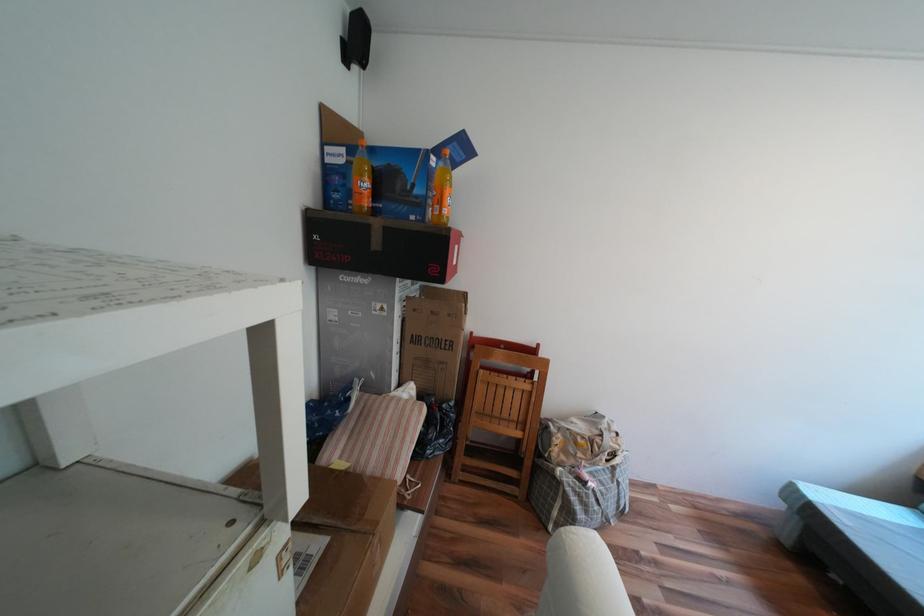
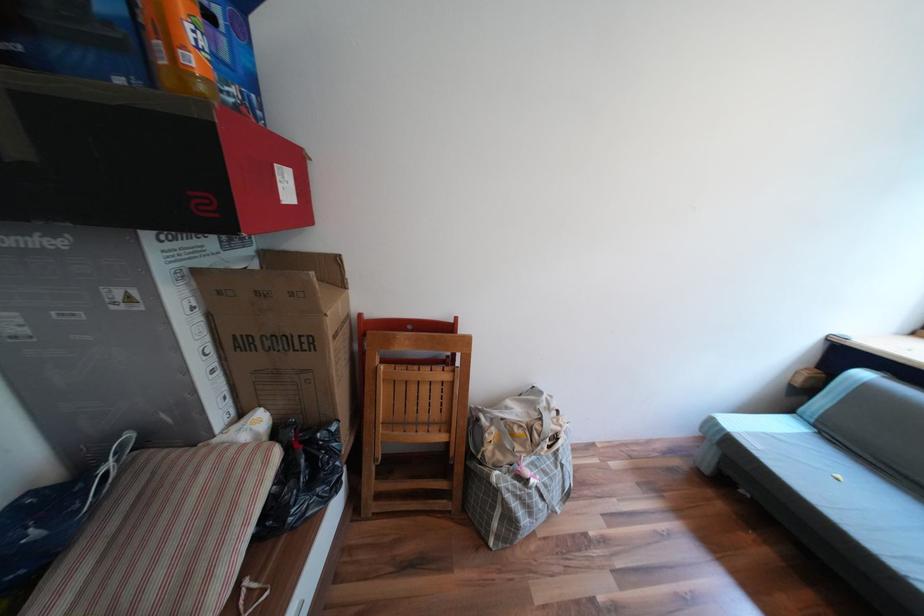
The point at (813, 496) is marked in the first image. Where is the corresponding point in the second image?

(733, 428)